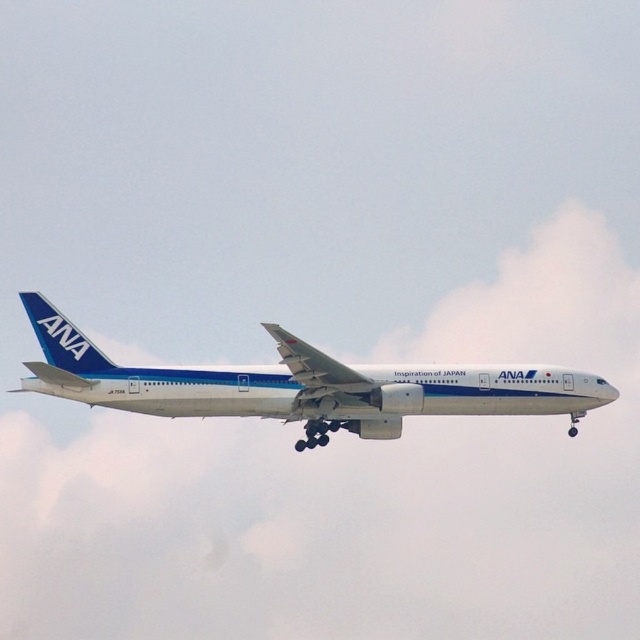
Question: Does white fluffy cloud at upper center have a lesser width compared to white glossy airplane at center?

Choices:
 (A) no
 (B) yes

Answer: (A)

Question: Does white fluffy cloud at upper center appear over white glossy airplane at center?

Choices:
 (A) no
 (B) yes

Answer: (A)

Question: From the image, what is the correct spatial relationship of white fluffy cloud at upper center in relation to white glossy airplane at center?

Choices:
 (A) right
 (B) left

Answer: (B)

Question: Among these points, which one is farthest from the camera?

Choices:
 (A) (618, 291)
 (B) (557, 368)

Answer: (A)

Question: Which point is farther to the camera?

Choices:
 (A) (221, 384)
 (B) (376, 554)

Answer: (B)